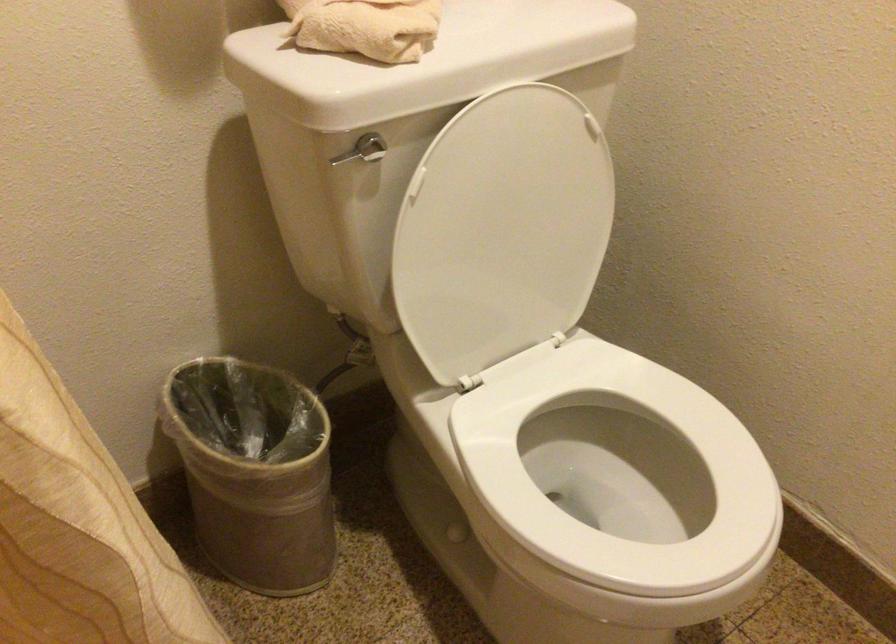
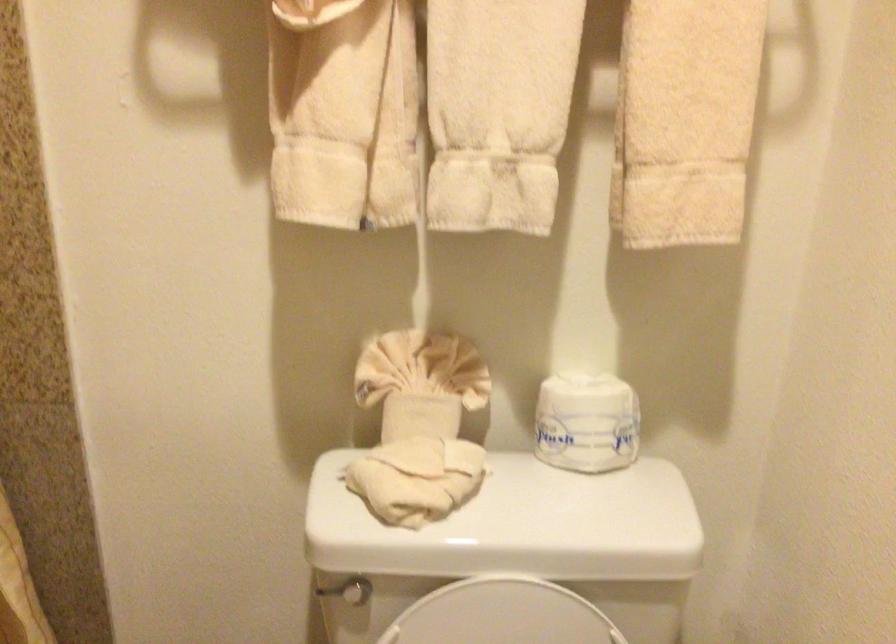
Question: The camera is either moving clockwise (left) or counter-clockwise (right) around the object. The first image is from the beginning of the video and the second image is from the end. Is the camera moving left or right when shooting the video?

Choices:
 (A) Left
 (B) Right

Answer: (B)